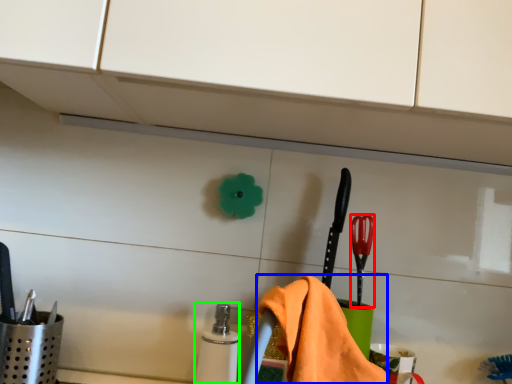
Question: Which object is positioned farthest from brush (highlighted by a red box)? Select from bath towel (highlighted by a blue box) and toiletry (highlighted by a green box).

Choices:
 (A) bath towel
 (B) toiletry

Answer: (B)